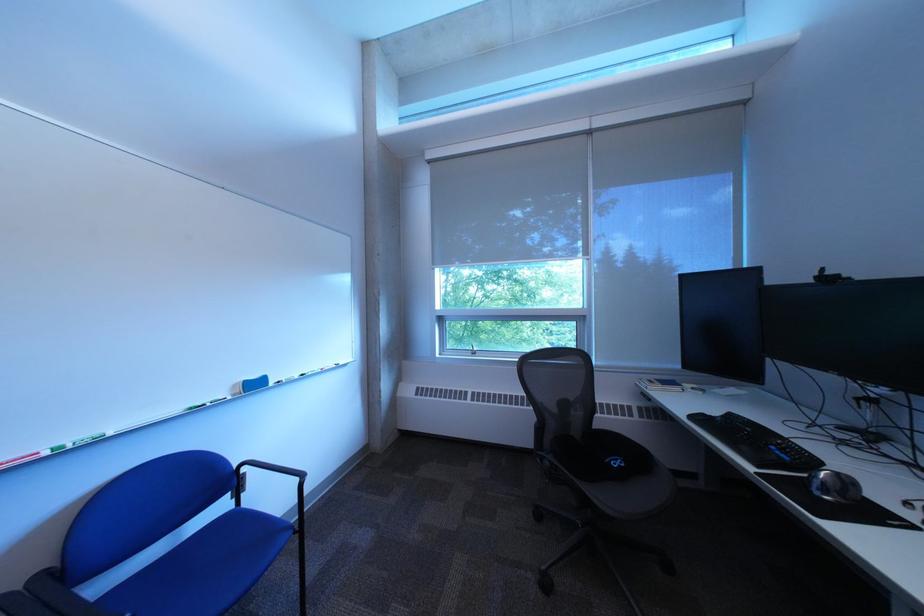
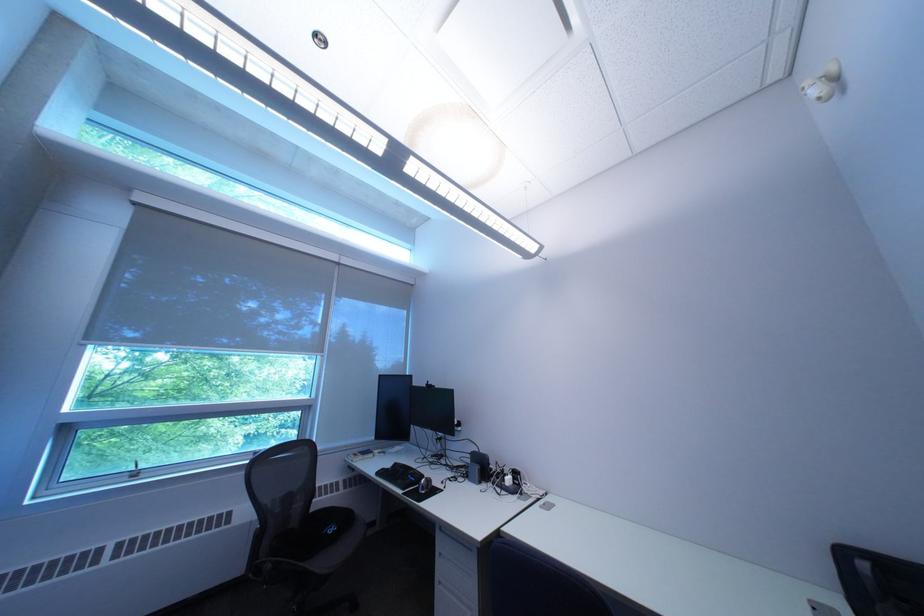
The point at [708,419] is marked in the first image. Where is the corresponding point in the second image?

(393, 475)